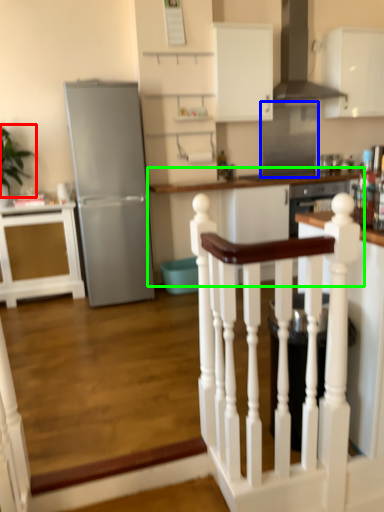
Question: Considering the real-world distances, which object is closest to plant (highlighted by a red box)? glass door (highlighted by a blue box) or table (highlighted by a green box).

Choices:
 (A) glass door
 (B) table

Answer: (B)